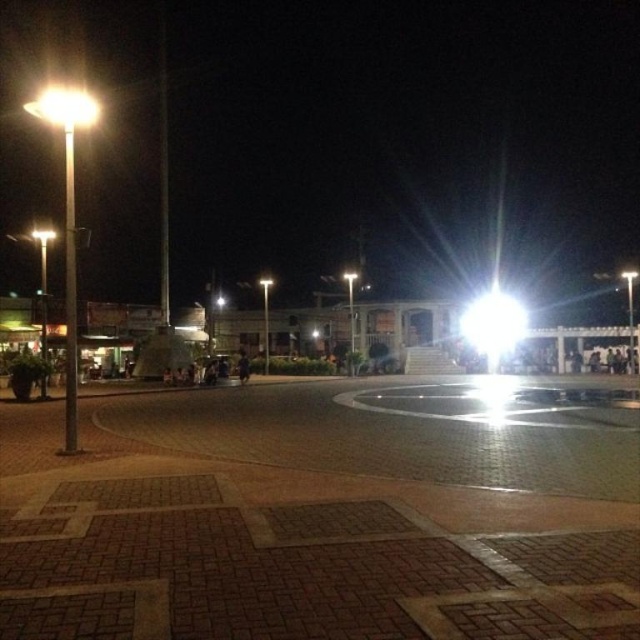
Which is in front, point (490, 323) or point (52, 109)?

Point (52, 109)

Does point (500, 292) come closer to viewer compared to point (68, 109)?

That is False.

Locate an element on the screen. This screenshot has height=640, width=640. bright white light at center is located at coordinates (492, 323).